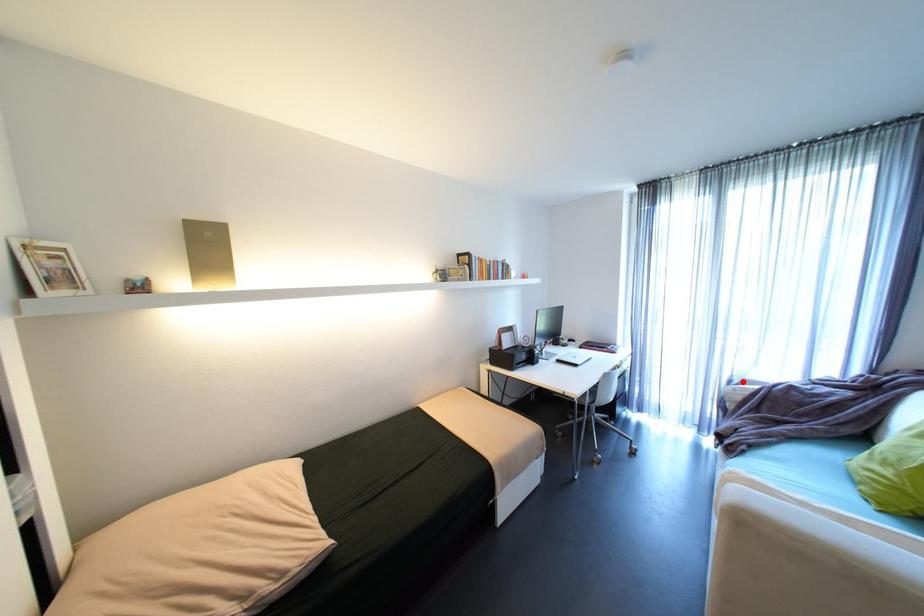
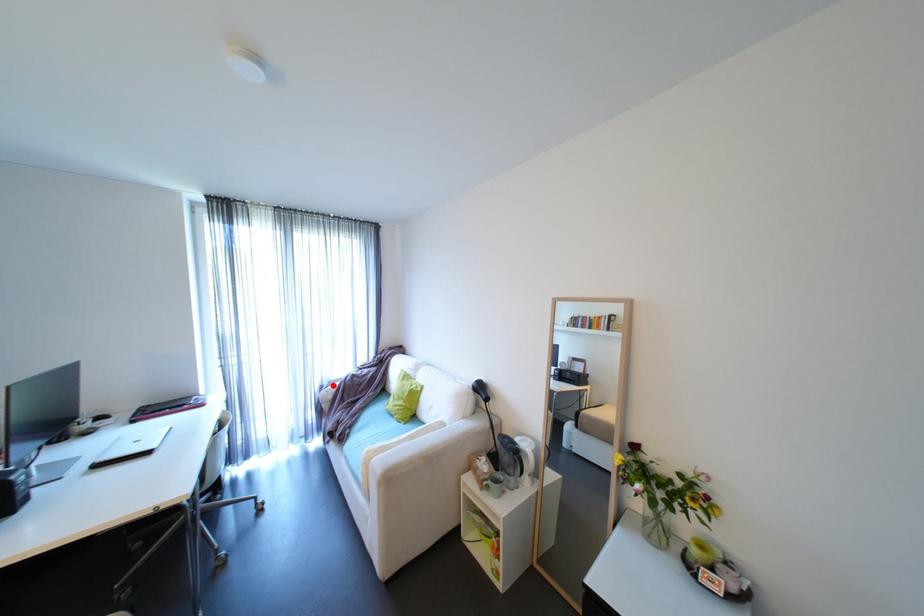
I am providing you with two images of the same scene from different viewpoints. A red point is marked on the first image and another point is marked on the second image. Is the marked point in image1 the same physical position as the marked point in image2?

Yes